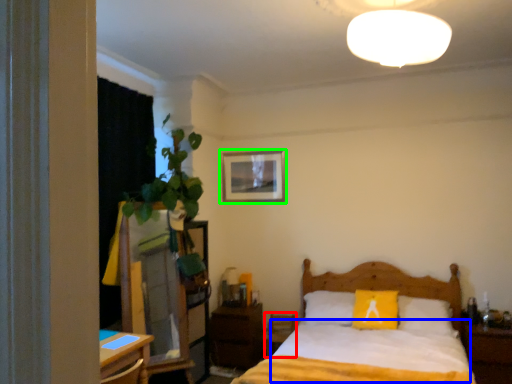
Question: Considering the real-world distances, which object is farthest from armchair (highlighted by a red box)? sheet (highlighted by a blue box) or picture frame (highlighted by a green box)?

Choices:
 (A) sheet
 (B) picture frame

Answer: (B)